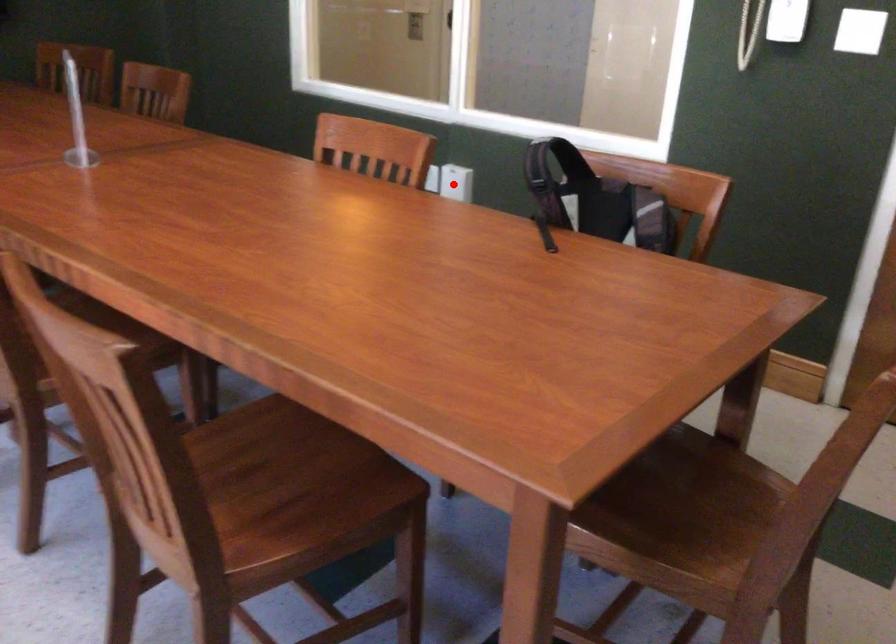
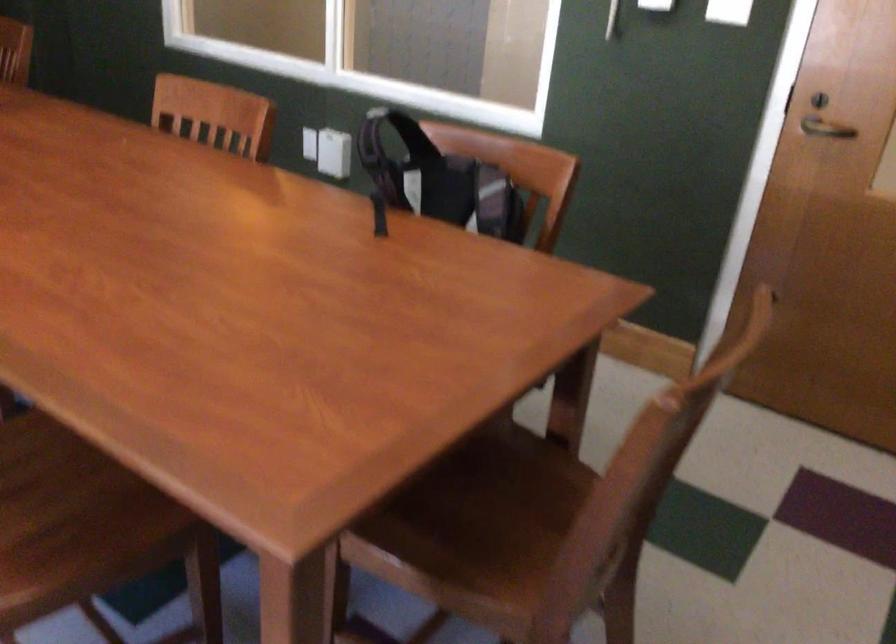
In the second image, find the point that corresponds to the highlighted location in the first image.

(333, 153)